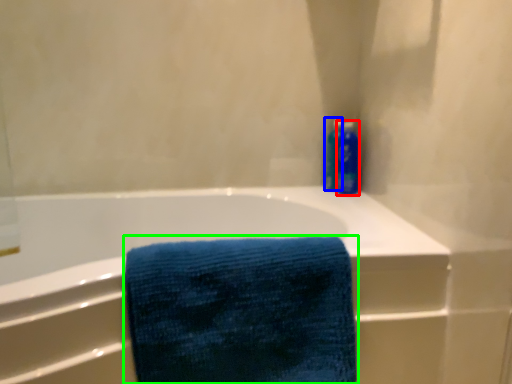
Question: Considering the real-world distances, which object is farthest from cleaning product (highlighted by a red box)? toiletry (highlighted by a blue box) or towel (highlighted by a green box)?

Choices:
 (A) toiletry
 (B) towel

Answer: (B)